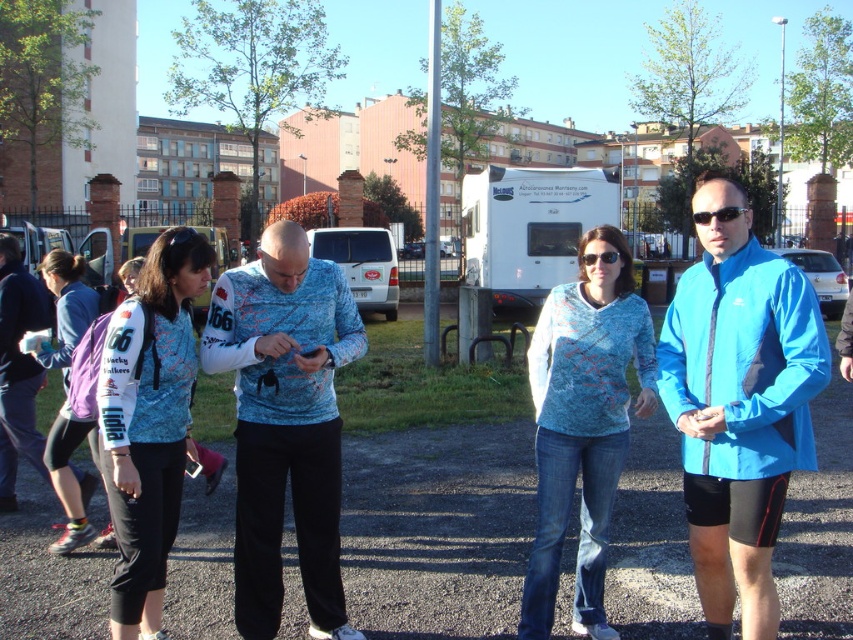
You are standing at the camera position and want to throw a frisbee to a friend. There are two points marked in the image. The first point is at coordinate point (561, 404), and the second point is at coordinate point (149, 616). Which point is closer to you?

Point (561, 404) is closer to the camera than point (149, 616), so the first point is closer to you.

You are a photographer setting up a tripod in the open area. You need to position it so that both the textured blue sweater at center and the purple fabric backpack at left are visible in the frame. Considering their heights, which object should be placed closer to the front of the frame to ensure both are fully visible?

The purple fabric backpack at left should be placed closer to the front of the frame because the textured blue sweater at center is taller. Positioning the shorter backpack forward will help keep both within the camera frame without one blocking the other.

You are a photographer standing in front of the group and want to take a photo that includes both the textured blue sweater at center and the matte blue vest at center. Which one is closer to you?

The textured blue sweater at center is closer to you than the matte blue vest at center.